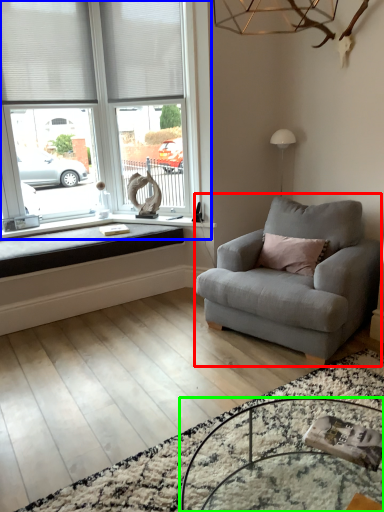
Question: Which object is the farthest from studio couch (highlighted by a red box)? Choose among these: window (highlighted by a blue box) or table (highlighted by a green box).

Choices:
 (A) window
 (B) table

Answer: (A)